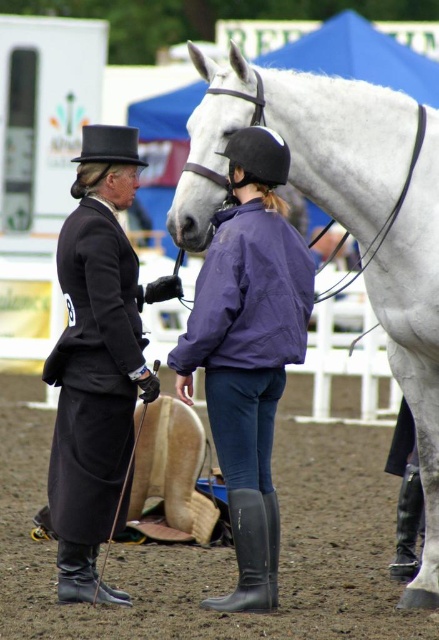
Can you confirm if rubber/matte boot at lower center is positioned below black rubber boot at lower right?

No.

Describe the element at coordinates (251, 552) in the screenshot. Image resolution: width=439 pixels, height=640 pixels. I see `rubber/matte boot at lower center` at that location.

Image resolution: width=439 pixels, height=640 pixels. I want to click on rubber/matte boot at lower center, so click(x=251, y=552).

Is white glossy horse at center positioned before black felt dress hat at upper left?

Yes, white glossy horse at center is closer to the viewer.

Does point (186, 248) come closer to viewer compared to point (105, 156)?

Yes, point (186, 248) is closer to viewer.

In order to click on white glossy horse at center in this screenshot , I will do tap(344, 216).

Does point (215, 566) come closer to viewer compared to point (406, 568)?

That is False.

Is brown dirt track at center smaller than black rubber boot at lower right?

Yes, brown dirt track at center is smaller than black rubber boot at lower right.

Where is `brown dirt track at center`? brown dirt track at center is located at coordinates (219, 547).

Find the location of a particular element. This screenshot has width=439, height=640. brown dirt track at center is located at coordinates (219, 547).